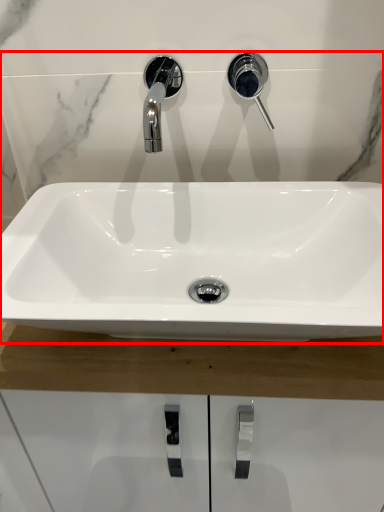
Question: From the image, what is the correct spatial relationship of sink (annotated by the red box) in relation to plumbing fixture?

Choices:
 (A) left
 (B) right

Answer: (A)